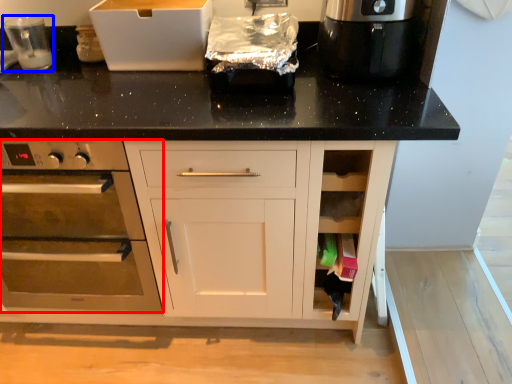
Question: Among these objects, which one is farthest to the camera, home appliance (highlighted by a red box) or appliance (highlighted by a blue box)?

Choices:
 (A) home appliance
 (B) appliance

Answer: (B)